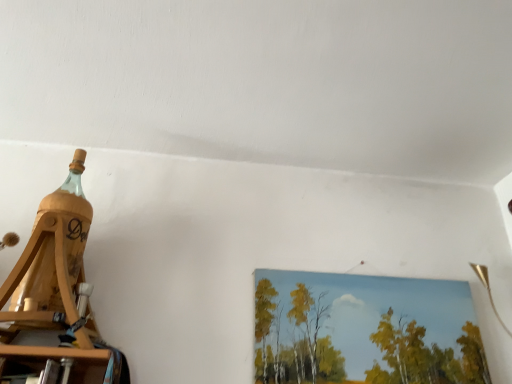
Question: In the image, is wooden picture frame at upper right positioned in front of or behind wooden bottle at left?

Choices:
 (A) behind
 (B) front

Answer: (A)

Question: Considering the positions of wooden picture frame at upper right and wooden bottle at left in the image, is wooden picture frame at upper right bigger or smaller than wooden bottle at left?

Choices:
 (A) big
 (B) small

Answer: (B)

Question: From the image's perspective, relative to wooden bottle at left, is wooden picture frame at upper right above or below?

Choices:
 (A) below
 (B) above

Answer: (A)

Question: Based on their sizes in the image, would you say wooden bottle at left is bigger or smaller than wooden picture frame at upper right?

Choices:
 (A) big
 (B) small

Answer: (A)

Question: Is wooden bottle at left in front of or behind wooden picture frame at upper right in the image?

Choices:
 (A) behind
 (B) front

Answer: (B)

Question: Does point (52, 332) appear closer or farther from the camera than point (354, 276)?

Choices:
 (A) farther
 (B) closer

Answer: (B)

Question: From the image's perspective, is wooden bottle at left above or below wooden picture frame at upper right?

Choices:
 (A) below
 (B) above

Answer: (B)